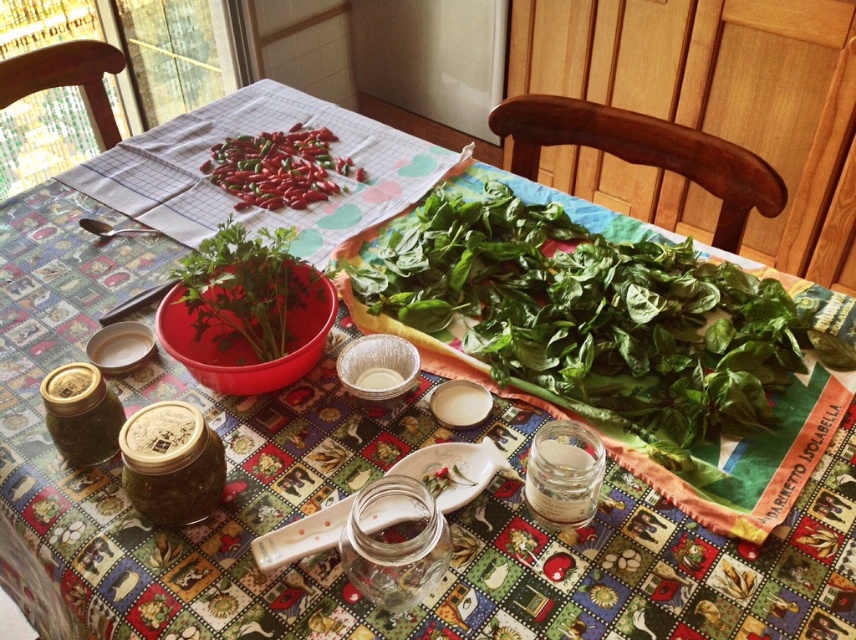
You are a chef preparing a dish and need to choose between the green leafy vegetable at center and the green leafy plant at center. Which one has a larger width?

The green leafy vegetable at center might be wider than the green leafy plant at center, so the vegetable could be the better choice if you need something wider.

You are preparing a dish that requires both fresh herbs and spicy elements. You have a green leafy plant at center and red matte chili peppers at center on your table. Which of these two items is bigger in size?

The green leafy plant at center is larger in size compared to the red matte chili peppers at center.

You are standing in front of the table and want to pick up both items located at point (296, 276) and point (289, 140). Which item should you reach for first to minimize the distance you need to move your hand?

You should reach for the item at point (296, 276) first because it is closer to you than the item at point (289, 140).